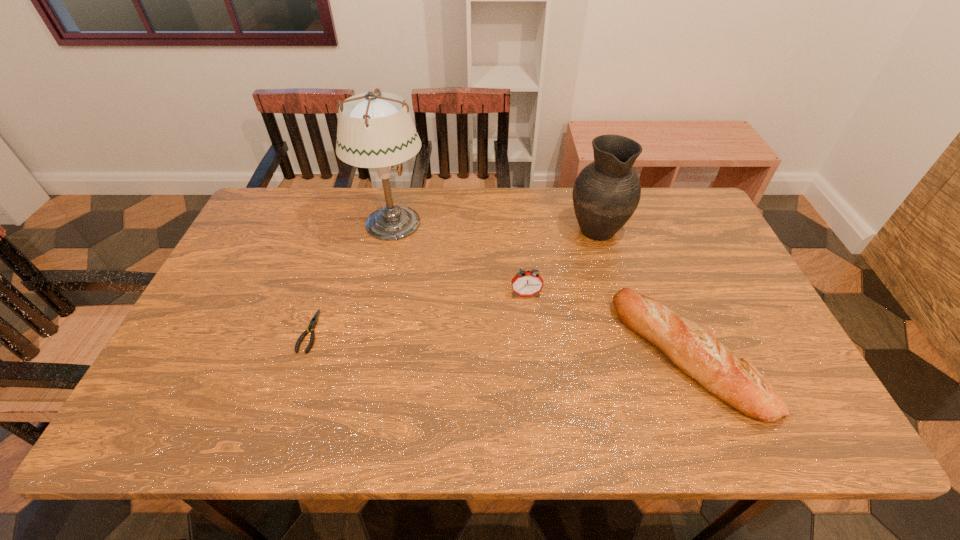
You are a GUI agent. You are given a task and a screenshot of the screen. Output one action in this format:
    pyautogui.click(x=<x>, y=<y>)
    Task: Click on the free space at the near edge
    This screenshot has width=960, height=540.
    Given the screenshot: What is the action you would take?
    pyautogui.click(x=588, y=408)

Locate an element on the screen. The height and width of the screenshot is (540, 960). free space at the left edge of the desktop is located at coordinates (230, 327).

Where is `free region at the right edge of the desktop`? free region at the right edge of the desktop is located at coordinates (713, 273).

At what (x,y) coordinates should I click in order to perform the action: click on blank space at the far left corner. Please return your answer as a coordinate pair (x, y). Looking at the image, I should click on (311, 192).

Where is `free spot at the far right corner of the desktop`? The height and width of the screenshot is (540, 960). free spot at the far right corner of the desktop is located at coordinates (670, 198).

Find the location of a particular element. The height and width of the screenshot is (540, 960). vacant point located between the pliers and the fourth tallest object is located at coordinates (498, 343).

Identify the location of empty space between the leftmost object and the baguet. The width and height of the screenshot is (960, 540). (498, 343).

The height and width of the screenshot is (540, 960). In order to click on vacant space in between the fourth tallest object and the third object from right to left in this screenshot , I will do `click(607, 325)`.

Find the location of `vacant area that lies between the baguet and the shortest object`. vacant area that lies between the baguet and the shortest object is located at coordinates (498, 343).

This screenshot has height=540, width=960. Identify the location of free area in between the pliers and the baguet. (498, 343).